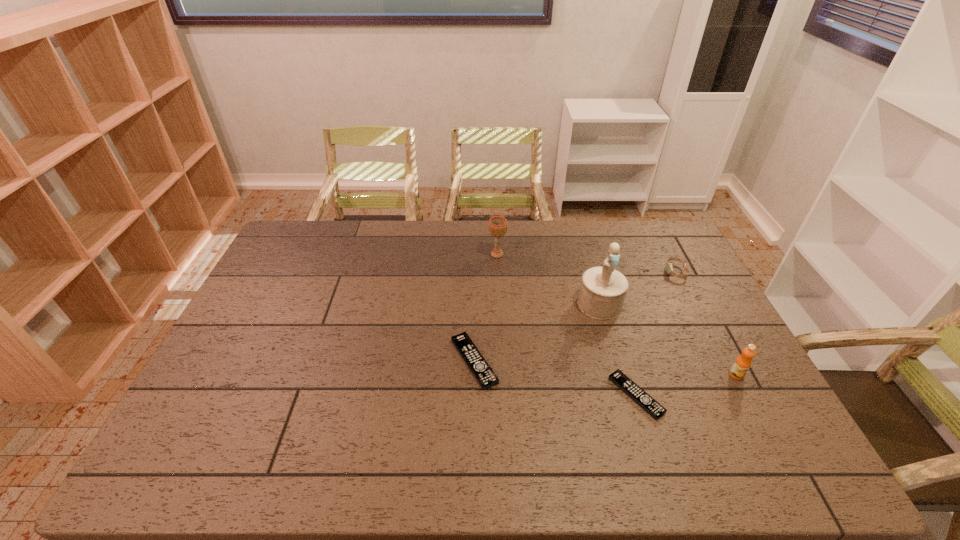
This screenshot has height=540, width=960. Find the location of `object present at the near edge`. object present at the near edge is located at coordinates (644, 400).

Find the location of a particular element. This screenshot has height=540, width=960. watch that is at the right edge is located at coordinates (669, 268).

Find the location of `orange juice positioned at the right edge`. orange juice positioned at the right edge is located at coordinates (741, 365).

Identify the location of free location at the far edge. (518, 222).

Image resolution: width=960 pixels, height=540 pixels. In the image, there is a desktop. What are the coordinates of `vacant space at the near edge` in the screenshot? It's located at (505, 412).

You are a GUI agent. You are given a task and a screenshot of the screen. Output one action in this format:
    pyautogui.click(x=<x>, y=<y>)
    Task: Click on the free location at the left edge
    The width and height of the screenshot is (960, 540).
    Given the screenshot: What is the action you would take?
    click(x=298, y=295)

In the image, there is a desktop. At what (x,y) coordinates should I click in order to perform the action: click on vacant space at the right edge. Please return your answer as a coordinate pair (x, y). The image size is (960, 540). Looking at the image, I should click on (689, 303).

In the image, there is a desktop. Where is `free region at the far left corner`? free region at the far left corner is located at coordinates (293, 236).

Identify the location of vacant space at the near left corner of the desktop. This screenshot has width=960, height=540. (234, 428).

This screenshot has height=540, width=960. Identify the location of vacant space at the far right corner of the desktop. pos(653,226).